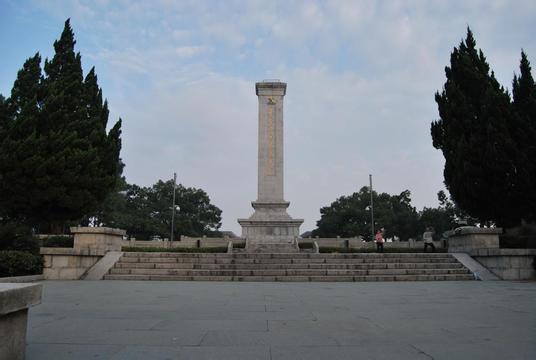
Locate an element on the screen. floor is located at coordinates (360, 301).